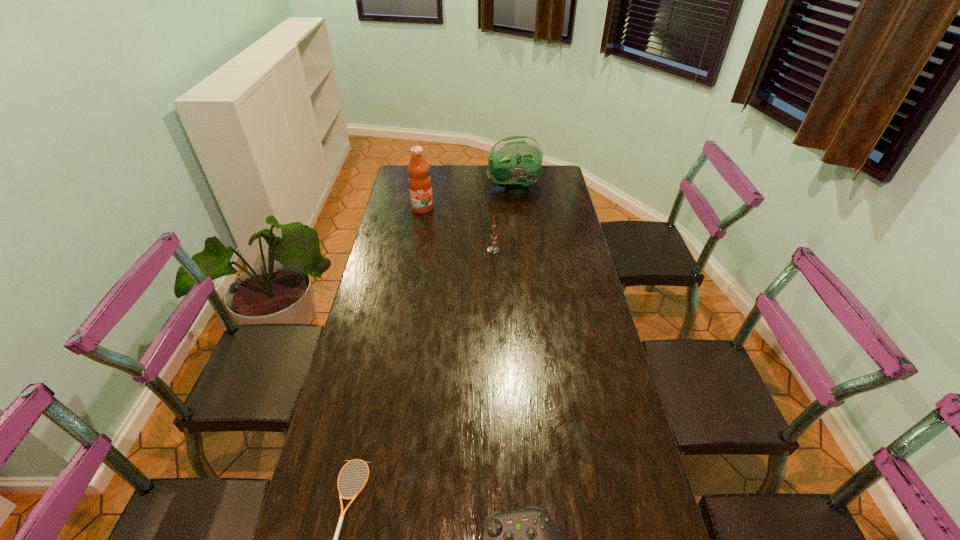
Find the location of a particular element. vacant space located 0.230m on the front-facing side of the third nearest object is located at coordinates (431, 250).

This screenshot has width=960, height=540. In order to click on object located at the far edge in this screenshot , I will do `click(515, 162)`.

What are the coordinates of `object at the left edge` in the screenshot? It's located at (420, 187).

Where is `object that is at the right edge`? The image size is (960, 540). object that is at the right edge is located at coordinates (515, 162).

The width and height of the screenshot is (960, 540). What are the coordinates of `object that is positioned at the far right corner` in the screenshot? It's located at (515, 162).

Where is `vacant space at the far edge of the desktop`? vacant space at the far edge of the desktop is located at coordinates (449, 173).

Where is `free region at the left edge of the desktop`? The width and height of the screenshot is (960, 540). free region at the left edge of the desktop is located at coordinates (313, 518).

At what (x,y) coordinates should I click in order to perform the action: click on vacant area at the right edge. Please return your answer as a coordinate pair (x, y). Looking at the image, I should click on (603, 528).

Find the location of a particular element. This screenshot has width=960, height=540. free space at the far right corner of the desktop is located at coordinates (561, 173).

Find the location of a particular element. The image size is (960, 540). vacant space that is in between the third nearest object and the second farthest object is located at coordinates (458, 229).